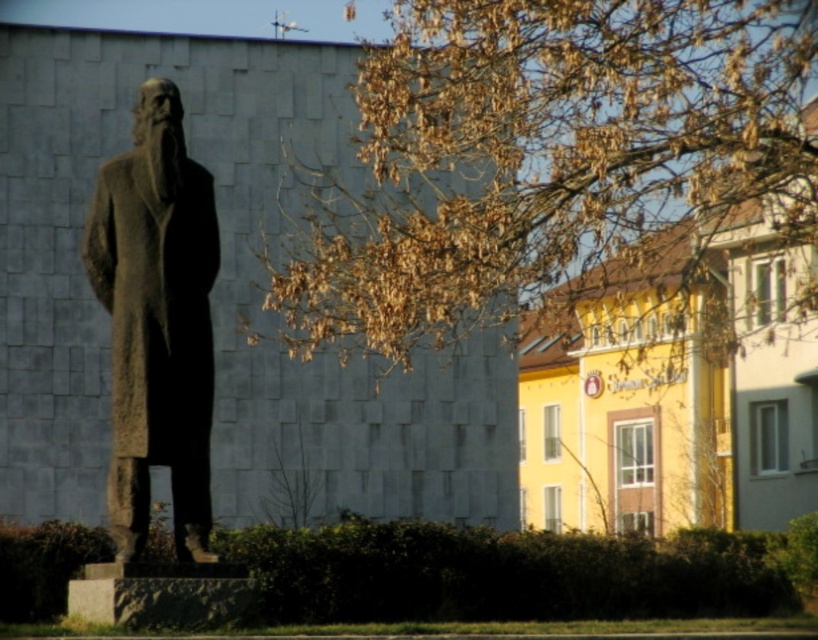
Is brown leafy branches at upper center taller than rough stone robe at left?

Yes, brown leafy branches at upper center is taller than rough stone robe at left.

Does brown leafy branches at upper center appear on the left side of rough stone robe at left?

No, brown leafy branches at upper center is not to the left of rough stone robe at left.

Image resolution: width=818 pixels, height=640 pixels. Identify the location of brown leafy branches at upper center. (544, 156).

Where is `brown leafy branches at upper center`? The image size is (818, 640). brown leafy branches at upper center is located at coordinates (544, 156).